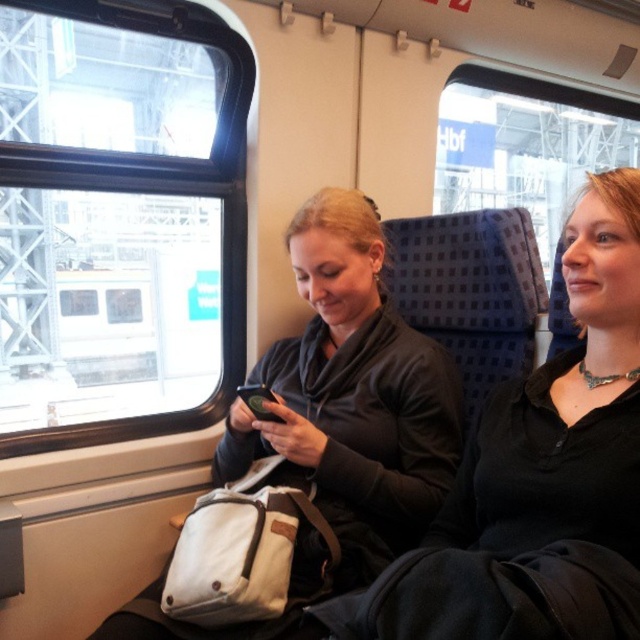
Question: Is black matte jacket at center bigger than matte black jacket at center?

Choices:
 (A) no
 (B) yes

Answer: (A)

Question: Which object appears farthest from the camera in this image?

Choices:
 (A) black matte jacket at center
 (B) matte black jacket at center
 (C) matte black phone at center

Answer: (C)

Question: Which point appears closest to the camera in this image?

Choices:
 (A) tap(97, 35)
 (B) tap(449, 467)
 (C) tap(253, 404)
 (D) tap(442, 632)

Answer: (D)

Question: Can you confirm if transparent glass window at upper left is wider than matte black phone at center?

Choices:
 (A) no
 (B) yes

Answer: (B)

Question: Estimate the real-world distances between objects in this image. Which object is farther from the matte black jacket at center?

Choices:
 (A) black matte jacket at center
 (B) transparent glass window at upper left
 (C) matte black phone at center

Answer: (B)

Question: Can you confirm if matte black jacket at center is positioned to the left of matte black phone at center?

Choices:
 (A) yes
 (B) no

Answer: (B)